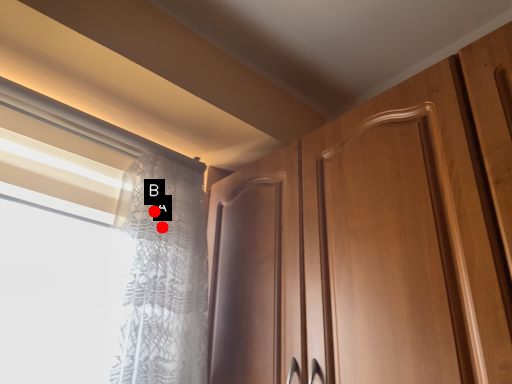
Question: Two points are circled on the image, labeled by A and B beside each circle. Which point appears closest to the camera in this image?

Choices:
 (A) A is closer
 (B) B is closer

Answer: (A)